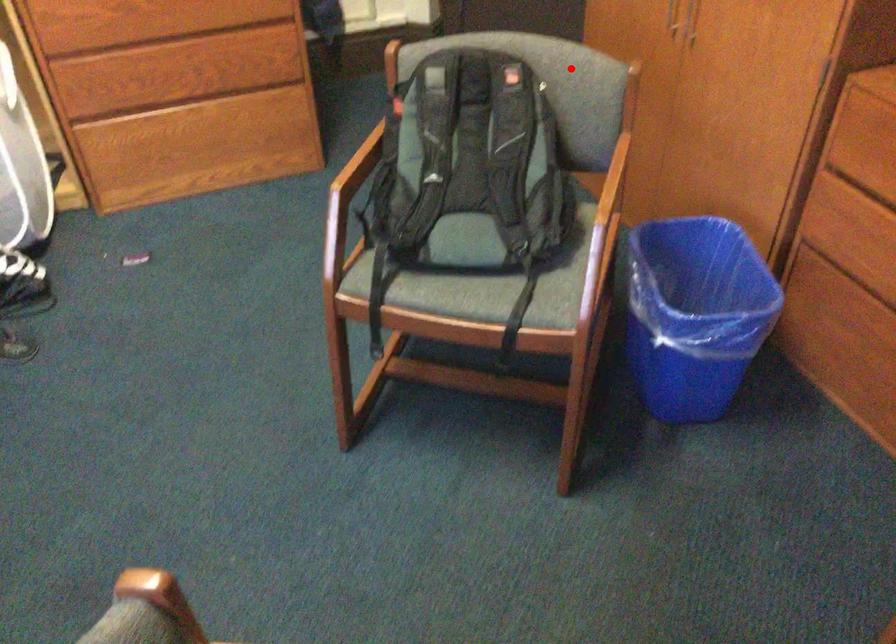
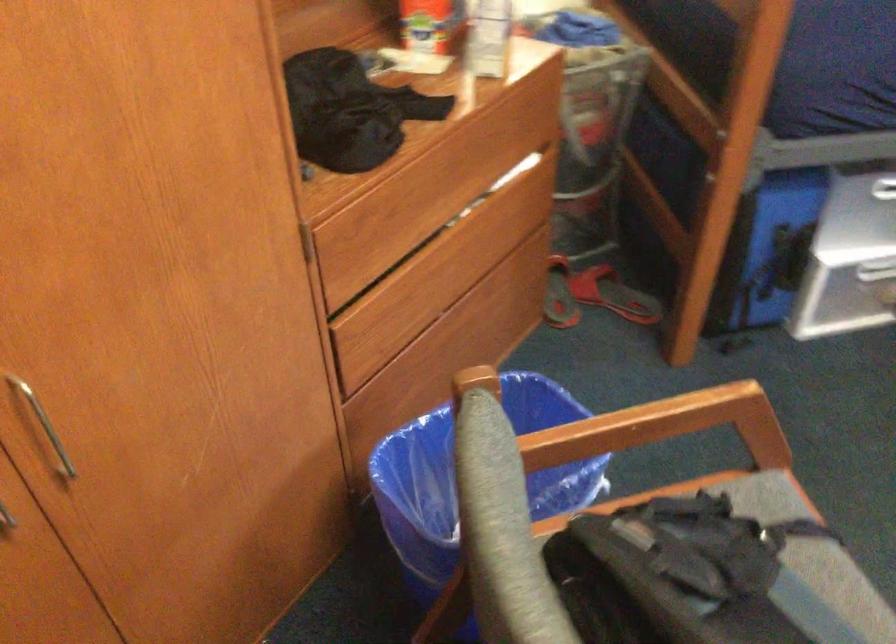
Question: A red point is marked in image1. In image2, is the corresponding 3D point closer to the camera or farther? Reply with the corresponding letter.

Choices:
 (A) The corresponding 3D point is closer.
 (B) The corresponding 3D point is farther.

Answer: (A)